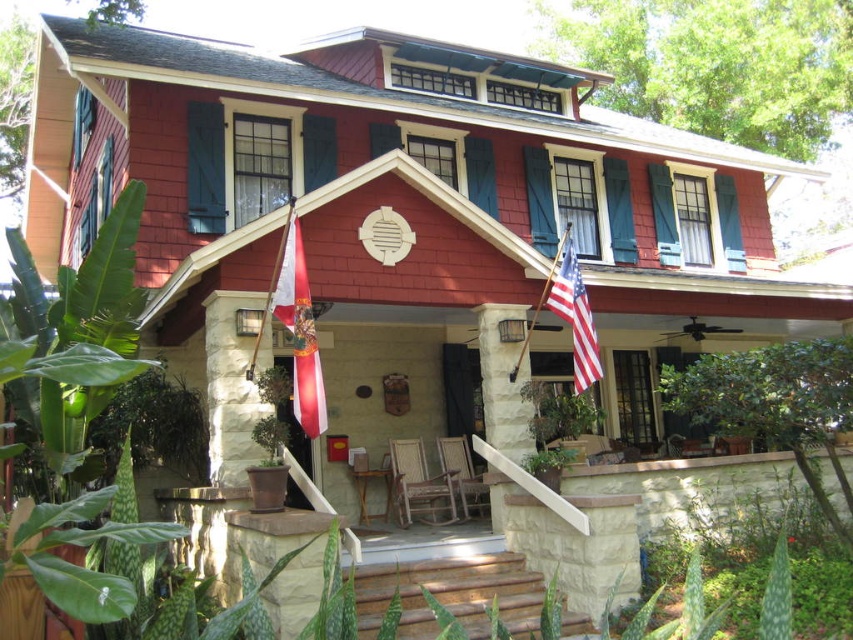
Who is higher up, white stone column at center or american flag at center?

american flag at center

Is white stone column at center positioned at the back of american flag at center?

No, it is in front of american flag at center.

Locate an element on the screen. The height and width of the screenshot is (640, 853). white stone column at center is located at coordinates (503, 384).

Who is higher up, white stone column at center or red/white striped flag at center?

red/white striped flag at center is above.

Is white stone column at center positioned in front of red/white striped flag at center?

No, it is behind red/white striped flag at center.

Who is more forward, (x=521, y=445) or (x=285, y=316)?

Point (x=285, y=316) is in front.

Locate an element on the screen. This screenshot has width=853, height=640. white stone column at center is located at coordinates (503, 384).

What do you see at coordinates (230, 387) in the screenshot? The width and height of the screenshot is (853, 640). I see `white stucco flagpole at lower left` at bounding box center [230, 387].

Can you confirm if white stucco flagpole at lower left is bigger than american flag at center?

Yes, white stucco flagpole at lower left is bigger than american flag at center.

What do you see at coordinates (230, 387) in the screenshot? This screenshot has height=640, width=853. I see `white stucco flagpole at lower left` at bounding box center [230, 387].

At what (x,y) coordinates should I click in order to perform the action: click on white stucco flagpole at lower left. Please return your answer as a coordinate pair (x, y). Image resolution: width=853 pixels, height=640 pixels. Looking at the image, I should click on (230, 387).